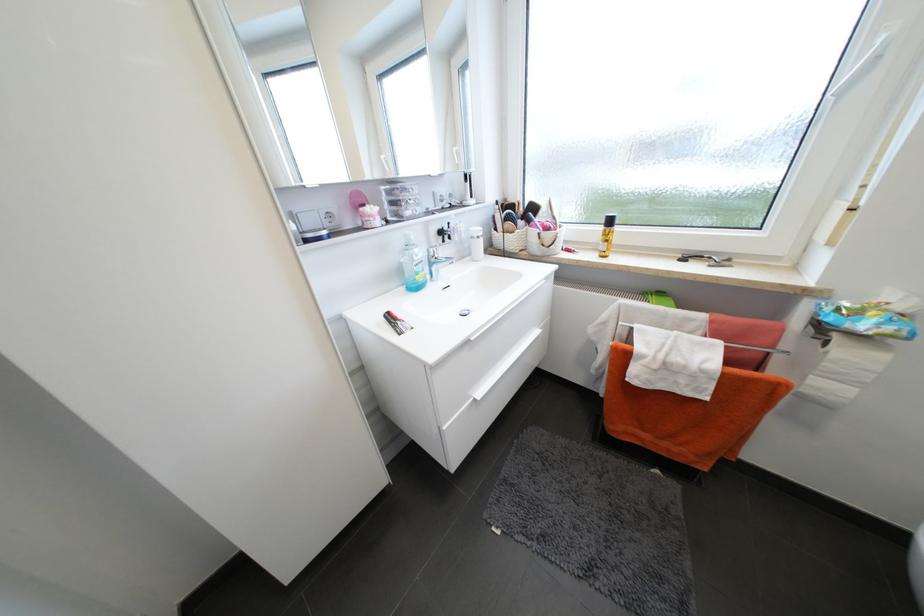
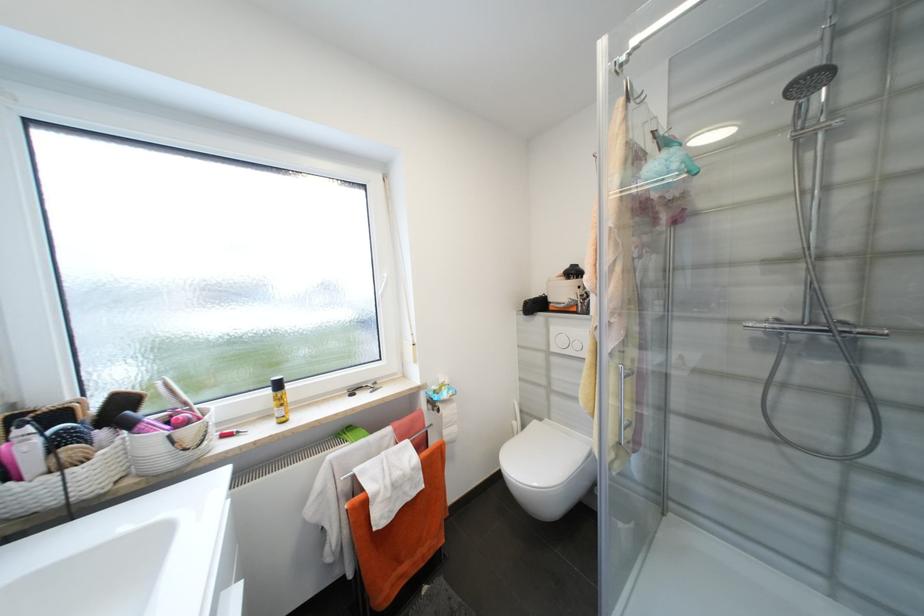
Find the pixel in the second image that matches point 615,223 in the first image.

(284, 386)